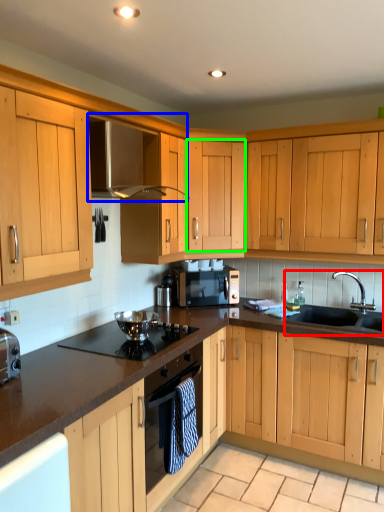
Question: Estimate the real-world distances between objects in this image. Which object is farther from sink (highlighted by a red box), exhaust hood (highlighted by a blue box) or cabinetry (highlighted by a green box)?

Choices:
 (A) exhaust hood
 (B) cabinetry

Answer: (A)